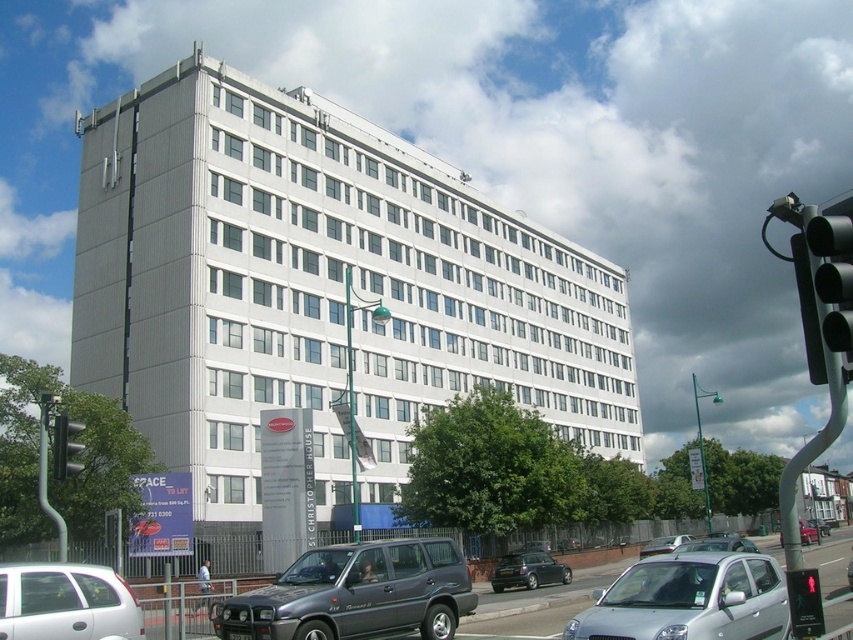
Is white matte hatchback at lower left closer to the viewer compared to black plastic traffic light at right?

No, white matte hatchback at lower left is behind black plastic traffic light at right.

Who is shorter, white matte hatchback at lower left or black plastic traffic light at right?

With less height is black plastic traffic light at right.

Where is `white matte hatchback at lower left`? Image resolution: width=853 pixels, height=640 pixels. white matte hatchback at lower left is located at coordinates (67, 602).

Where is `white matte hatchback at lower left`? white matte hatchback at lower left is located at coordinates (67, 602).

Find the location of `black plastic traffic light at right`. black plastic traffic light at right is located at coordinates (833, 276).

Between black plastic traffic light at right and green glass traffic light at left, which one is positioned lower?

green glass traffic light at left is below.

What do you see at coordinates (833, 276) in the screenshot? I see `black plastic traffic light at right` at bounding box center [833, 276].

The height and width of the screenshot is (640, 853). I want to click on black plastic traffic light at right, so click(x=833, y=276).

Who is taller, black plastic traffic light at right or metallic gray car at lower center?

metallic gray car at lower center is taller.

Locate an element on the screen. Image resolution: width=853 pixels, height=640 pixels. black plastic traffic light at right is located at coordinates (833, 276).